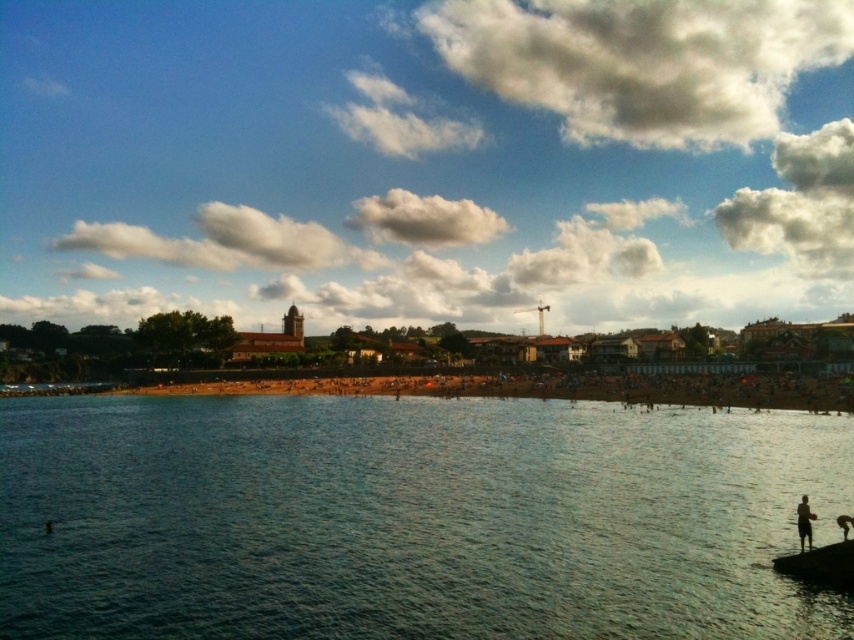
You are standing on the beach and want to take a photo of the clear blue water at center and the silhouette human at lower right. If you face the water, which direction should you turn to include both in your shot?

Since the clear blue water at center is to the left of the silhouette human at lower right, you should turn to your left to capture both in the photo.

You are a photographer trying to capture the clear blue water at center in your shot. Based on its position, where should you aim your camera?

The clear blue water at center is located at the coordinates point (411, 516), so you should aim your camera at that position to capture it.